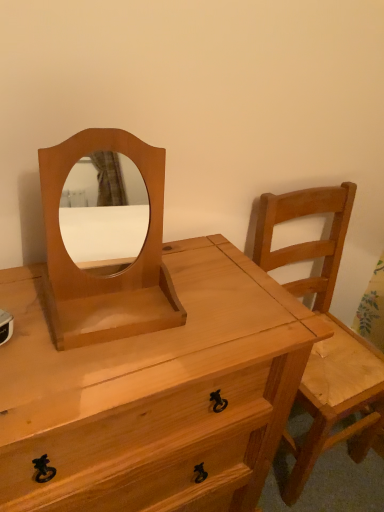
At what (x,y) coordinates should I click in order to perform the action: click on blank space situated above natural wood chest of drawers at center (from a real-world perspective). Please return your answer as a coordinate pair (x, y). Looking at the image, I should click on (118, 321).